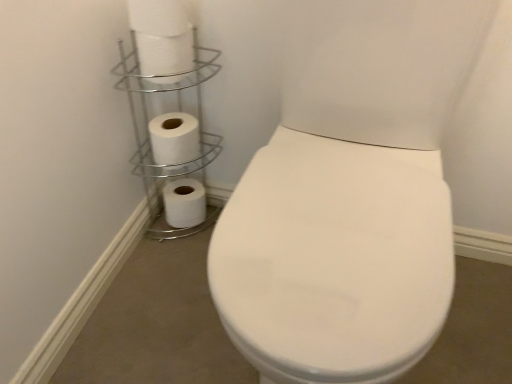
Where is `vacant area in front of white matte toilet paper at lower left, placed as the first toilet paper when sorted from back to front`? vacant area in front of white matte toilet paper at lower left, placed as the first toilet paper when sorted from back to front is located at coordinates (169, 253).